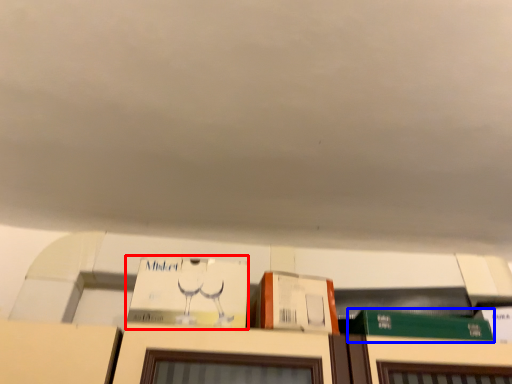
Question: Among these objects, which one is farthest to the camera, book (highlighted by a red box) or book (highlighted by a blue box)?

Choices:
 (A) book
 (B) book

Answer: (B)